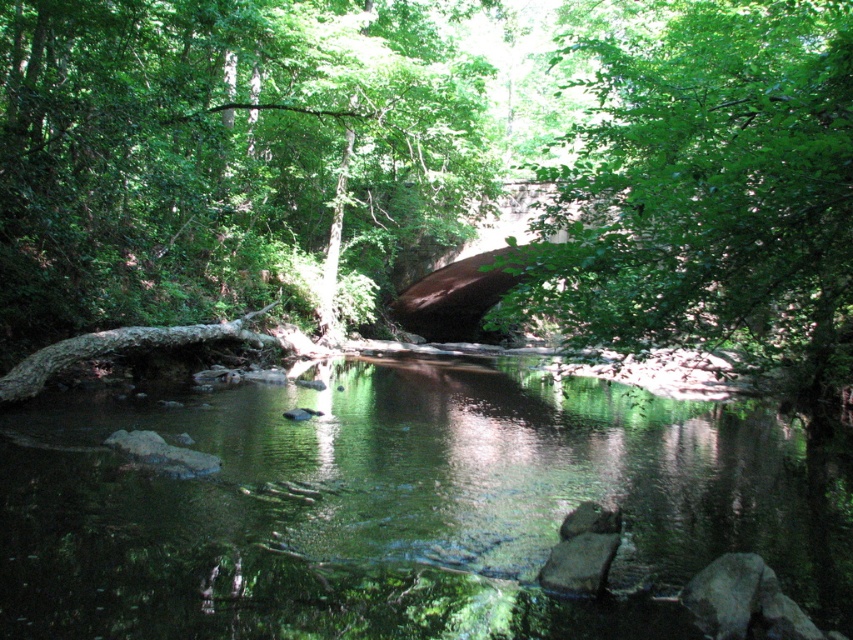
Question: Which point is closer to the camera?

Choices:
 (A) (308, 605)
 (B) (59, 346)
 (C) (3, 216)

Answer: (A)

Question: Which point appears farthest from the camera in this image?

Choices:
 (A) tap(155, 616)
 (B) tap(827, 316)
 (C) tap(13, 381)
 (D) tap(39, 16)

Answer: (D)

Question: Among these objects, which one is farthest from the camera?

Choices:
 (A) brown rough log at left
 (B) green leafy tree at upper center
 (C) green leafy tree at center

Answer: (C)

Question: Does green leafy tree at upper center come behind brown rough log at left?

Choices:
 (A) yes
 (B) no

Answer: (B)

Question: Where is green reflective water at center located in relation to green leafy tree at upper center in the image?

Choices:
 (A) left
 (B) right

Answer: (A)

Question: Does green leafy tree at center come behind green leafy tree at upper center?

Choices:
 (A) yes
 (B) no

Answer: (A)